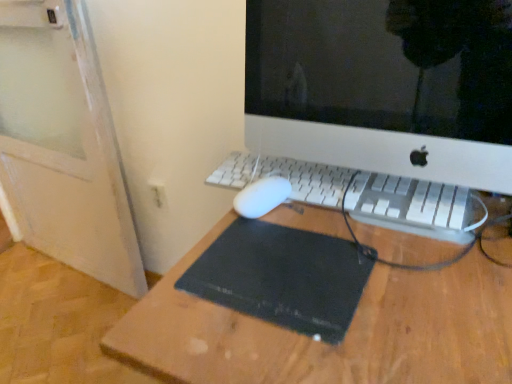
Question: Is white plastic keyboard at center wider or thinner than white plastic computer monitor at center?

Choices:
 (A) thin
 (B) wide

Answer: (A)

Question: Is white plastic keyboard at center taller or shorter than white plastic computer monitor at center?

Choices:
 (A) tall
 (B) short

Answer: (B)

Question: Estimate the real-world distances between objects in this image. Which object is farther from the white plastic keyboard at center?

Choices:
 (A) white plastic electric outlet at lower left
 (B) black rubber mousepad at center
 (C) white plastic computer monitor at center

Answer: (C)

Question: Which object is positioned farthest from the black rubber mousepad at center?

Choices:
 (A) white plastic computer monitor at center
 (B) white plastic keyboard at center
 (C) white plastic electric outlet at lower left

Answer: (A)